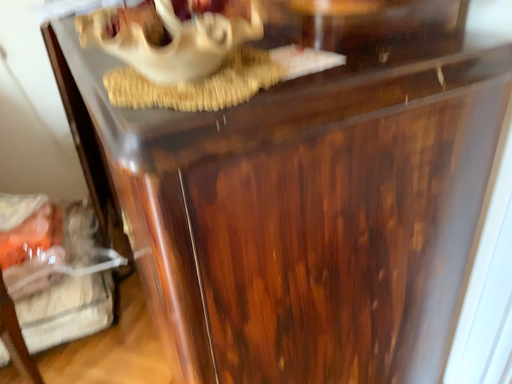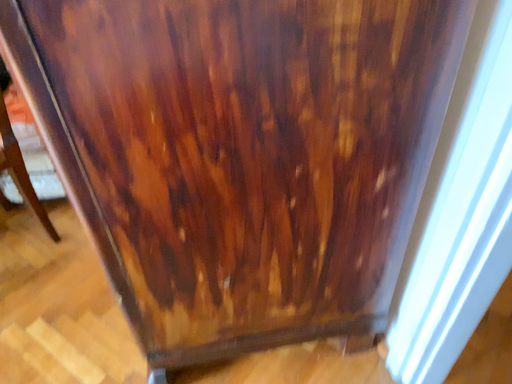
Question: How did the camera likely rotate when shooting the video?

Choices:
 (A) rotated upward
 (B) rotated downward

Answer: (B)